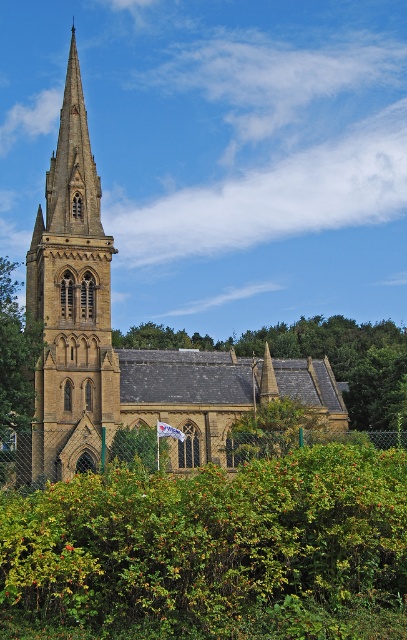
Is green leafy bush at center closer to camera compared to green leafy tree at center?

Yes, green leafy bush at center is in front of green leafy tree at center.

Does green leafy bush at center have a lesser width compared to green leafy tree at center?

Yes, green leafy bush at center is thinner than green leafy tree at center.

Find the location of a particular element. This screenshot has width=407, height=640. green leafy bush at center is located at coordinates (212, 552).

Locate an element on the screen. green leafy bush at center is located at coordinates click(212, 552).

Is point (153, 381) farther from camera compared to point (93, 225)?

Yes, point (153, 381) is behind point (93, 225).

Which is below, golden stone church at center or brown stone tower at left?

golden stone church at center is lower down.

At what (x,y) coordinates should I click in order to perform the action: click on golden stone church at center. Please return your answer as a coordinate pair (x, y). Looking at the image, I should click on (124, 348).

In the scene shown: Can you confirm if golden stone church at center is positioned above green leafy tree at left?

Yes.

Does golden stone church at center have a larger size compared to green leafy tree at left?

Correct, golden stone church at center is larger in size than green leafy tree at left.

Locate an element on the screen. golden stone church at center is located at coordinates (124, 348).